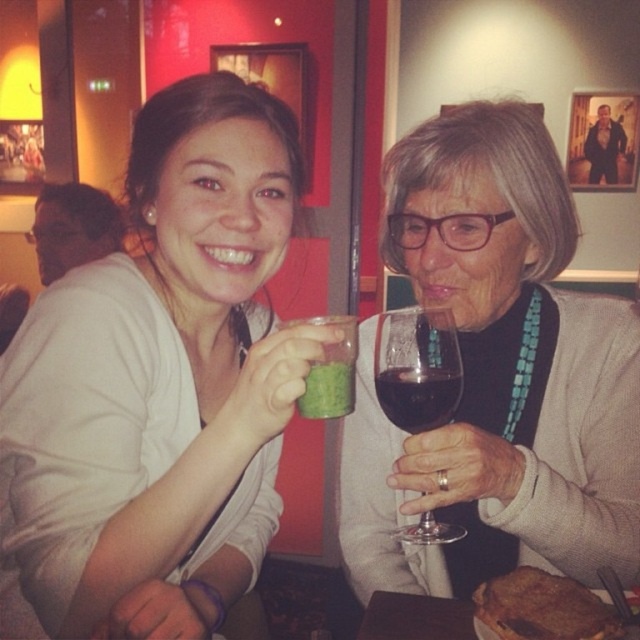
You are a photographer setting up for a photo shoot in this scene. You need to place a small decorative item between the dark red glass at upper center and the wooden table at lower center. Which object should the item be placed closer to if you want it to be near the smaller one?

The dark red glass at upper center is smaller than the wooden table at lower center, so the item should be placed closer to the dark red glass at upper center.

You are a photographer setting up for a portrait. You notice the matte white shirt at center and the transparent glass at upper right in your frame. Which object should you focus on to ensure the subject with the larger size in the scene is captured clearly?

The matte white shirt at center is larger in size than the transparent glass at upper right, so you should focus on the matte white shirt at center to ensure the larger subject is captured clearly.

You are a photographer setting up for a portrait. You need to ensure that the matte white shirt at center and the transparent glass at upper right are both visible in the shot. Based on their positions, which object might be more challenging to capture clearly?

The transparent glass at upper right might be more challenging to capture clearly because it is behind the matte white shirt at center, which could block or obscure part of the glass in the photo.